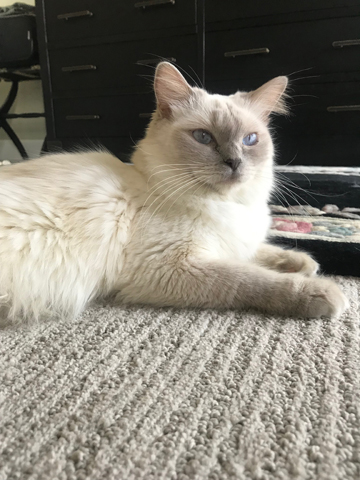
You are a GUI agent. You are given a task and a screenshot of the screen. Output one action in this format:
    pyautogui.click(x=<x>, y=<y>)
    Task: Click on the drawer
    The image size is (360, 480).
    Given the screenshot: What is the action you would take?
    pyautogui.click(x=112, y=114), pyautogui.click(x=108, y=80), pyautogui.click(x=110, y=21), pyautogui.click(x=315, y=115), pyautogui.click(x=304, y=56), pyautogui.click(x=266, y=7)